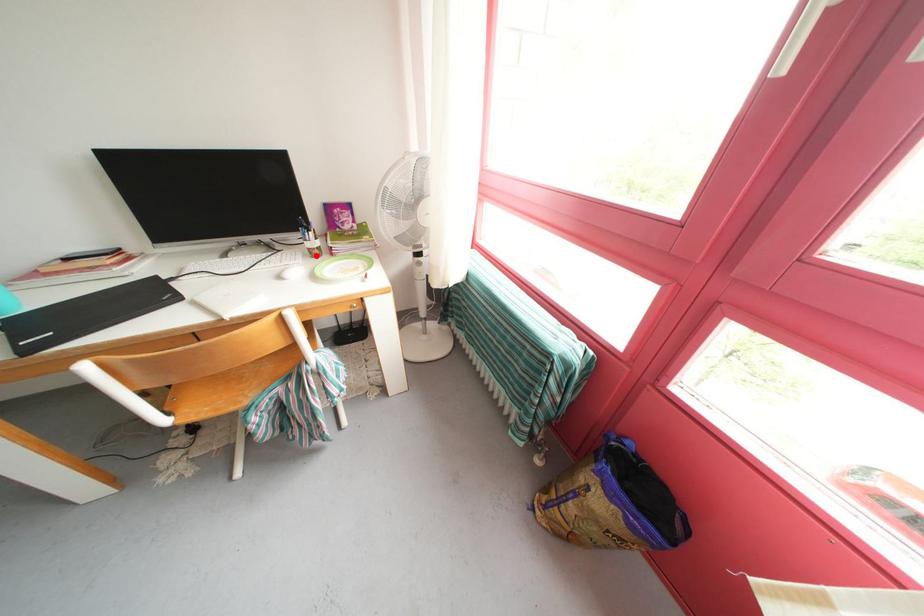
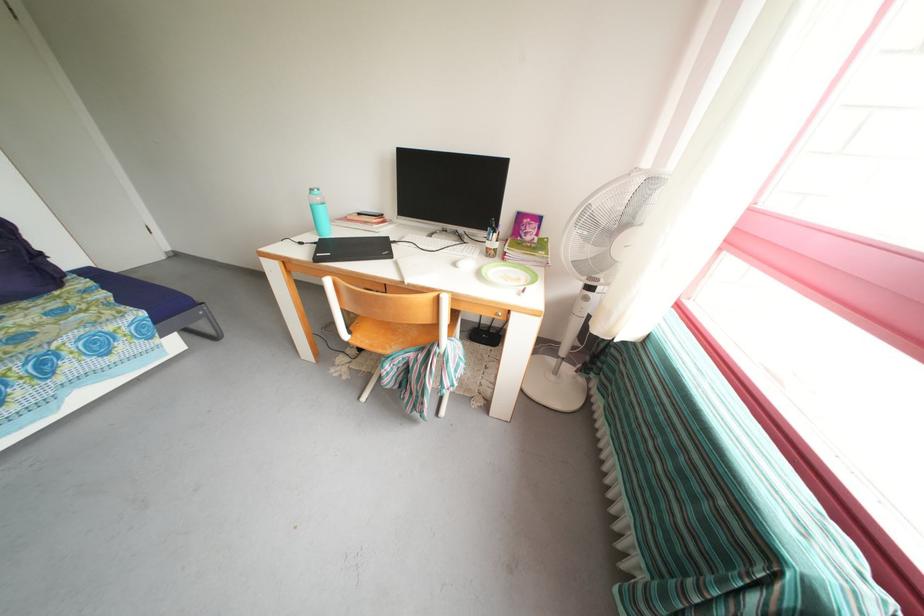
The point at the highlighted location is marked in the first image. Where is the corresponding point in the second image?

(494, 254)